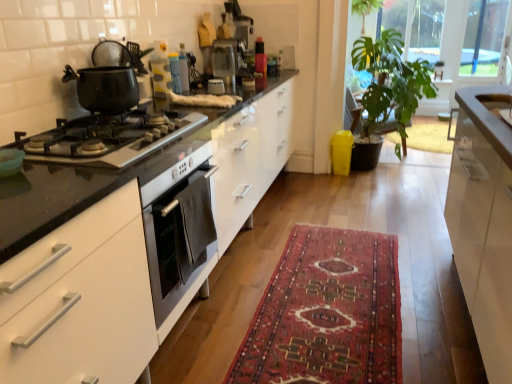
Question: Is shiny black gas stove at left, the 1th gas stove positioned from the top, further to the viewer compared to matte plastic container at upper center, which is the 2th appliance from front to back?

Choices:
 (A) yes
 (B) no

Answer: (B)

Question: Could you tell me if shiny black gas stove at left, the second gas stove when ordered from bottom to top, is facing matte plastic container at upper center, the first appliance positioned from the back?

Choices:
 (A) yes
 (B) no

Answer: (B)

Question: Is shiny black gas stove at left, the second gas stove when ordered from bottom to top, taller than matte plastic container at upper center, which is the 2th appliance from front to back?

Choices:
 (A) no
 (B) yes

Answer: (A)

Question: Is shiny black gas stove at left, the second gas stove when ordered from bottom to top, at the right side of matte plastic container at upper center, the first appliance positioned from the back?

Choices:
 (A) yes
 (B) no

Answer: (B)

Question: Can you confirm if shiny black gas stove at left, the second gas stove when ordered from bottom to top, is shorter than matte plastic container at upper center, which is the 2th appliance from front to back?

Choices:
 (A) no
 (B) yes

Answer: (B)

Question: In terms of width, does matte plastic container at upper center, the first appliance positioned from the back, look wider or thinner when compared to green leafy plant at upper right, the first window screen in the left-to-right sequence?

Choices:
 (A) thin
 (B) wide

Answer: (A)

Question: Is point (169, 61) closer or farther from the camera than point (389, 8)?

Choices:
 (A) farther
 (B) closer

Answer: (B)

Question: Considering the positions of matte plastic container at upper center, which is the second appliance in right-to-left order, and green leafy plant at upper right, the second window screen when ordered from right to left, in the image, is matte plastic container at upper center, which is the second appliance in right-to-left order, taller or shorter than green leafy plant at upper right, the second window screen when ordered from right to left,?

Choices:
 (A) tall
 (B) short

Answer: (B)

Question: From the image's perspective, relative to green leafy plant at upper right, the first window screen in the left-to-right sequence, is matte plastic container at upper center, which is the second appliance in right-to-left order, above or below?

Choices:
 (A) below
 (B) above

Answer: (A)

Question: Does point (83, 163) appear closer or farther from the camera than point (368, 110)?

Choices:
 (A) farther
 (B) closer

Answer: (B)

Question: From the image's perspective, relative to green leafy plant at center, is black glass gas stove at left, the 2th gas stove when ordered from top to bottom, above or below?

Choices:
 (A) above
 (B) below

Answer: (B)

Question: Is black glass gas stove at left, the 2th gas stove when ordered from top to bottom, to the left or to the right of green leafy plant at center in the image?

Choices:
 (A) left
 (B) right

Answer: (A)

Question: Is black glass gas stove at left, the 2th gas stove when ordered from top to bottom, taller or shorter than green leafy plant at center?

Choices:
 (A) short
 (B) tall

Answer: (A)

Question: From a real-world perspective, relative to red woven rug at center, is shiny black gas stove at left, the 1th gas stove positioned from the top, vertically above or below?

Choices:
 (A) below
 (B) above

Answer: (B)

Question: Is shiny black gas stove at left, the 1th gas stove positioned from the top, spatially inside red woven rug at center, or outside of it?

Choices:
 (A) outside
 (B) inside

Answer: (A)